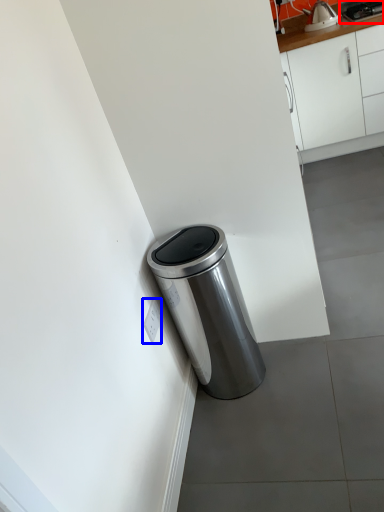
Question: Which of the following is the closest to the observer, appliance (highlighted by a red box) or electric outlet (highlighted by a blue box)?

Choices:
 (A) appliance
 (B) electric outlet

Answer: (B)